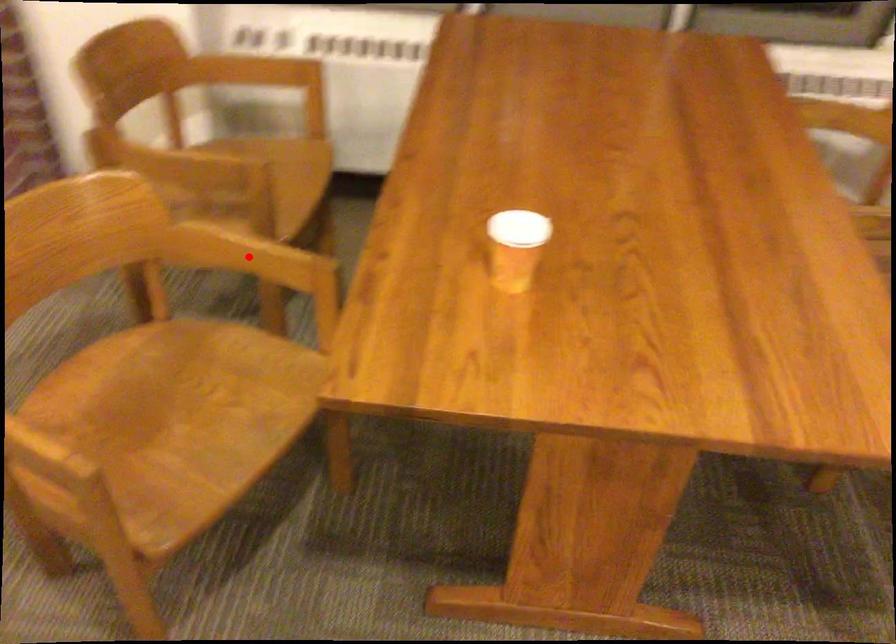
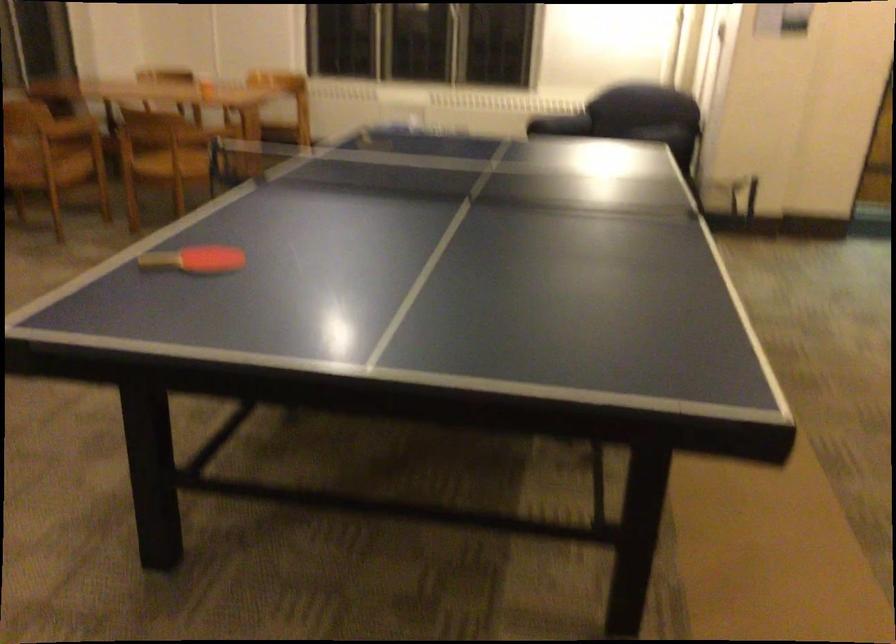
Question: I am providing you with two images of the same scene from different viewpoints. A red point is marked on the first image. At the location where the point appears in image 1, is it still visible in image 2?

Choices:
 (A) Yes
 (B) No

Answer: (B)